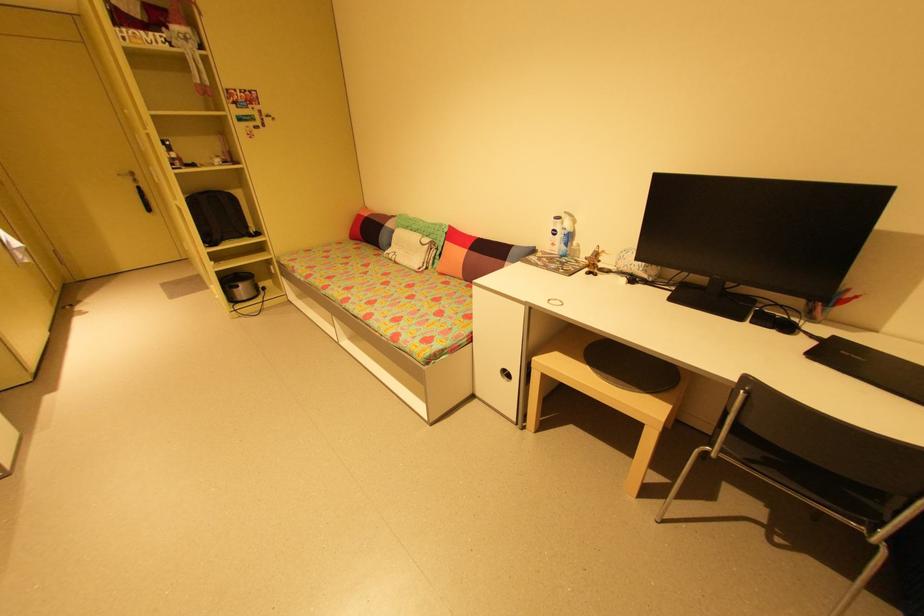
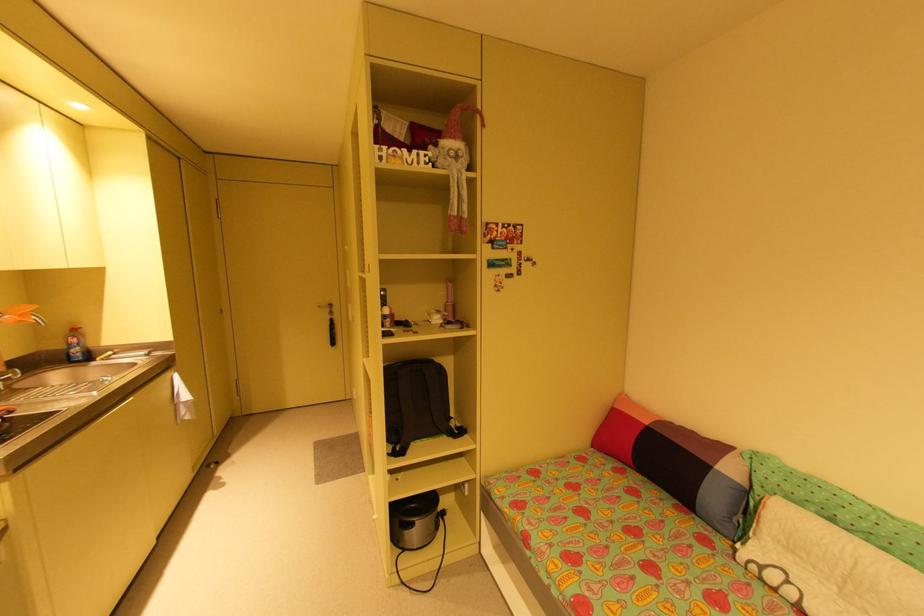
Locate, in the second image, the point that corresponds to pixel 136 177 in the first image.

(333, 310)